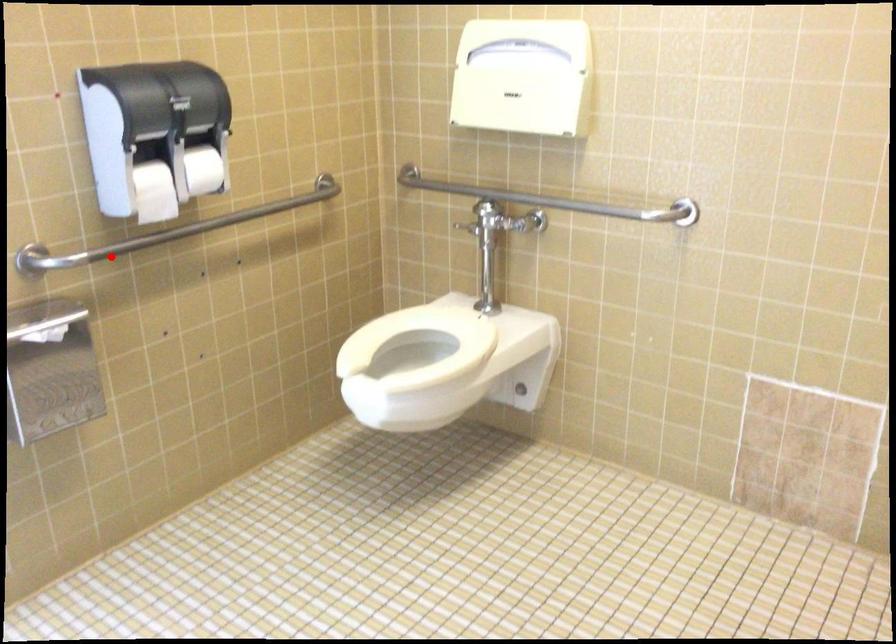
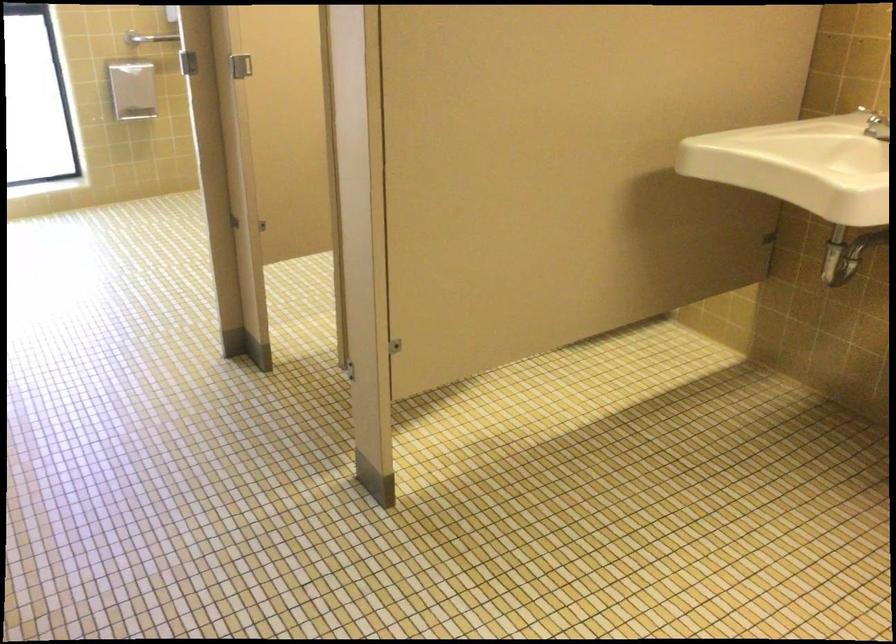
Locate, in the second image, the point that corresponds to the highlighted location in the first image.

(149, 38)